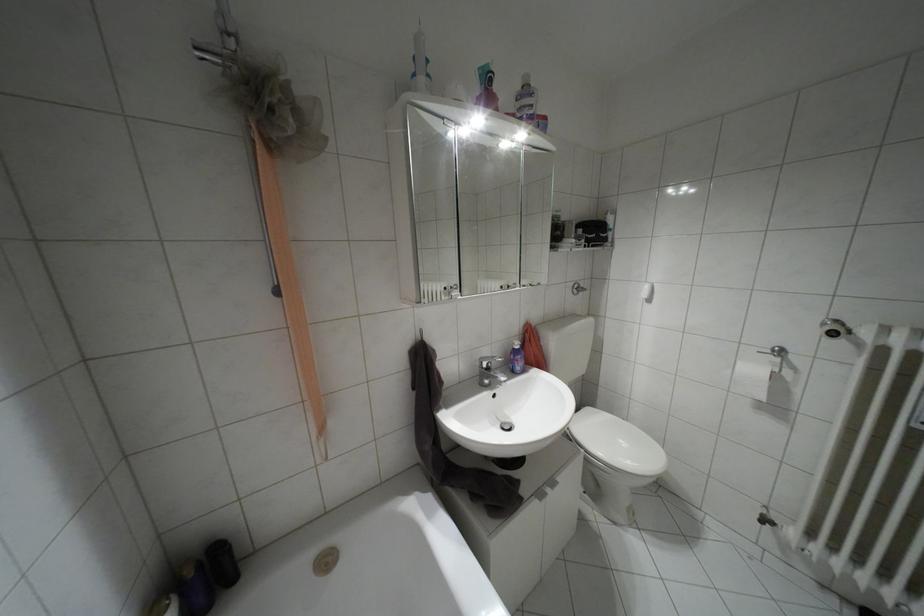
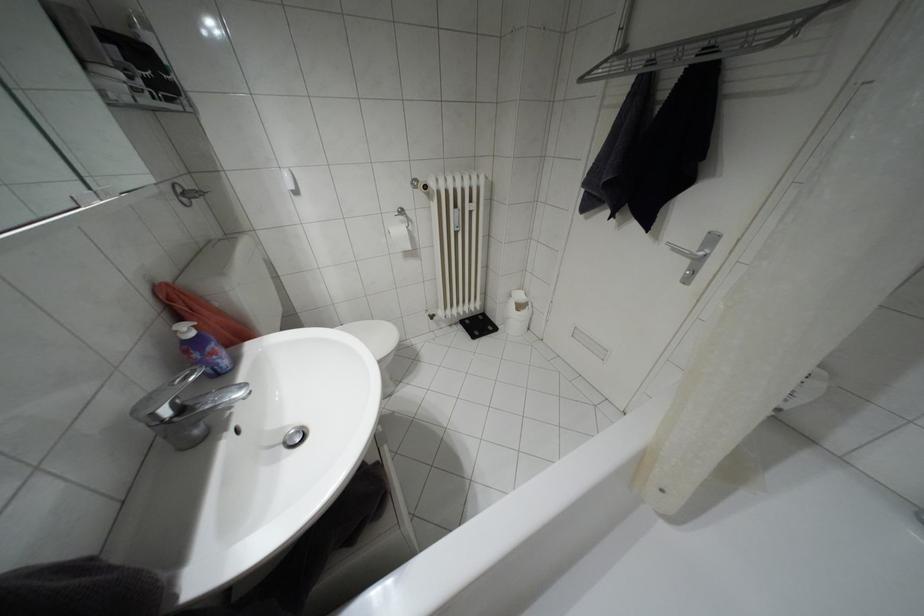
Find the pixel in the second image that matches [488,368] in the first image.

(180, 408)